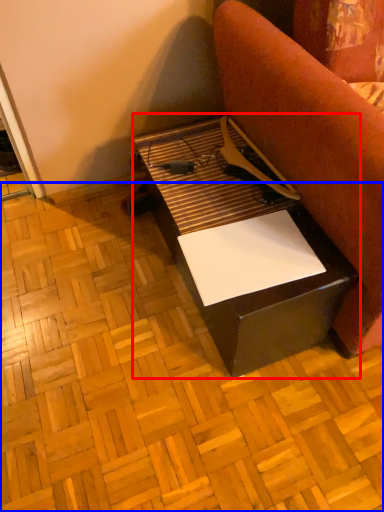
Question: Which point is closer to the camera, table (highlighted by a red box) or plywood (highlighted by a blue box)?

Choices:
 (A) table
 (B) plywood

Answer: (B)